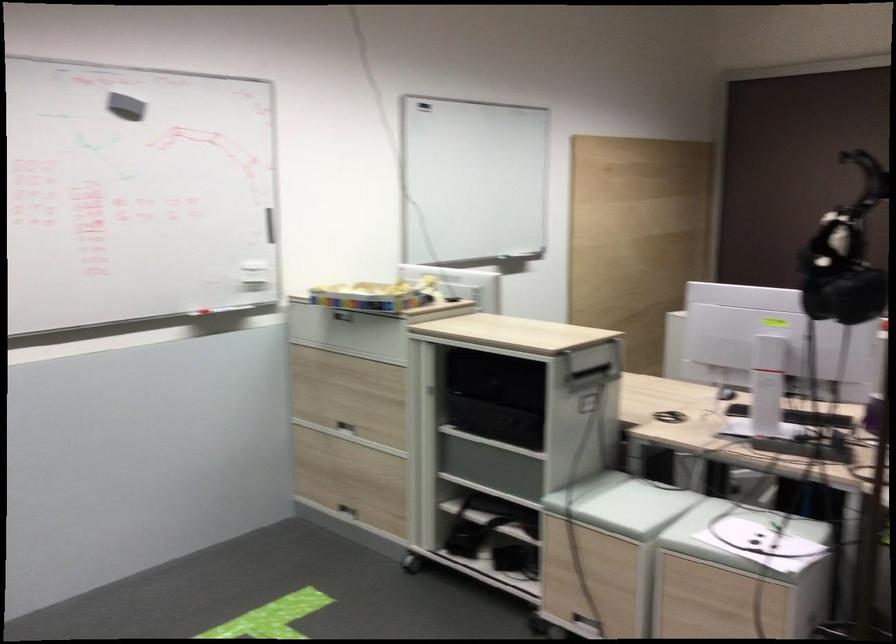
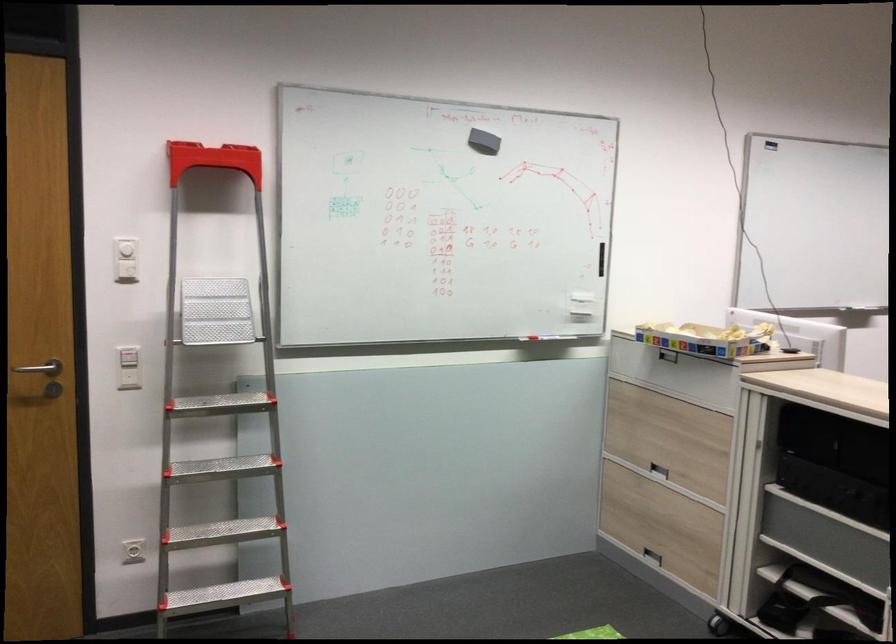
Question: I am providing you with two images of the same scene from different viewpoints. After the viewpoint changes to image2, which objects are now occluded?

Choices:
 (A) white wall dial
 (B) white  wall button
 (C) black bag strap
 (D) none of these

Answer: (D)